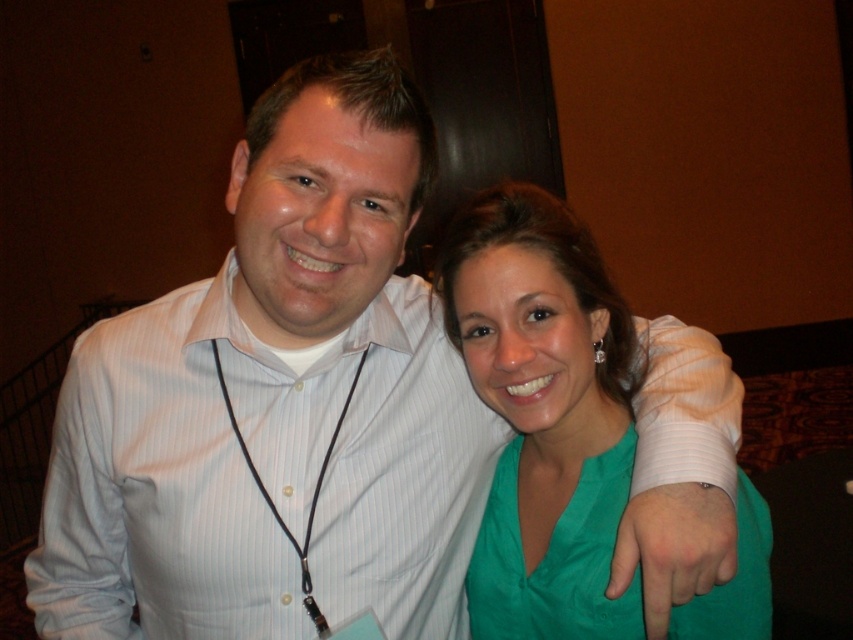
Question: Which is nearer to the green satin dress at center?

Choices:
 (A) green satin hand at center
 (B) green satin blouse at center

Answer: (B)

Question: Can you confirm if white bandage at upper right is wider than green satin hand at center?

Choices:
 (A) no
 (B) yes

Answer: (B)

Question: Which of the following is the closest to the observer?

Choices:
 (A) (474, 620)
 (B) (527, 458)
 (C) (670, 556)

Answer: (C)

Question: Does green satin blouse at center appear under green satin hand at center?

Choices:
 (A) no
 (B) yes

Answer: (A)

Question: Does white striped shirt at center appear under green satin blouse at center?

Choices:
 (A) no
 (B) yes

Answer: (B)

Question: Which object is the closest to the green satin dress at center?

Choices:
 (A) green satin hand at center
 (B) white bandage at upper right

Answer: (B)